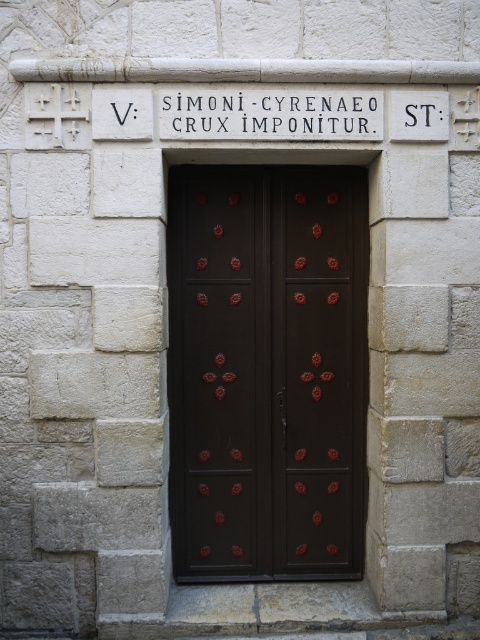
Question: Is dark wood door at center to the right of white stone sign at center from the viewer's perspective?

Choices:
 (A) no
 (B) yes

Answer: (A)

Question: Among these points, which one is farthest from the camera?

Choices:
 (A) (305, 115)
 (B) (212, 252)

Answer: (B)

Question: Among these objects, which one is nearest to the camera?

Choices:
 (A) white stone sign at center
 (B) dark wood door at center

Answer: (A)

Question: Which of the following is the closest to the observer?

Choices:
 (A) (227, 416)
 (B) (187, 92)

Answer: (B)

Question: Considering the relative positions of dark wood door at center and white stone sign at center in the image provided, where is dark wood door at center located with respect to white stone sign at center?

Choices:
 (A) below
 (B) above

Answer: (A)

Question: Does dark wood door at center appear under white stone sign at center?

Choices:
 (A) yes
 (B) no

Answer: (A)